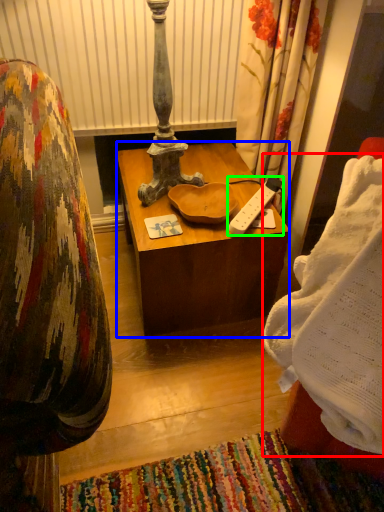
Question: Estimate the real-world distances between objects in this image. Which object is farther from blanket (highlighted by a red box), desk (highlighted by a blue box) or remote control (highlighted by a green box)?

Choices:
 (A) desk
 (B) remote control

Answer: (A)